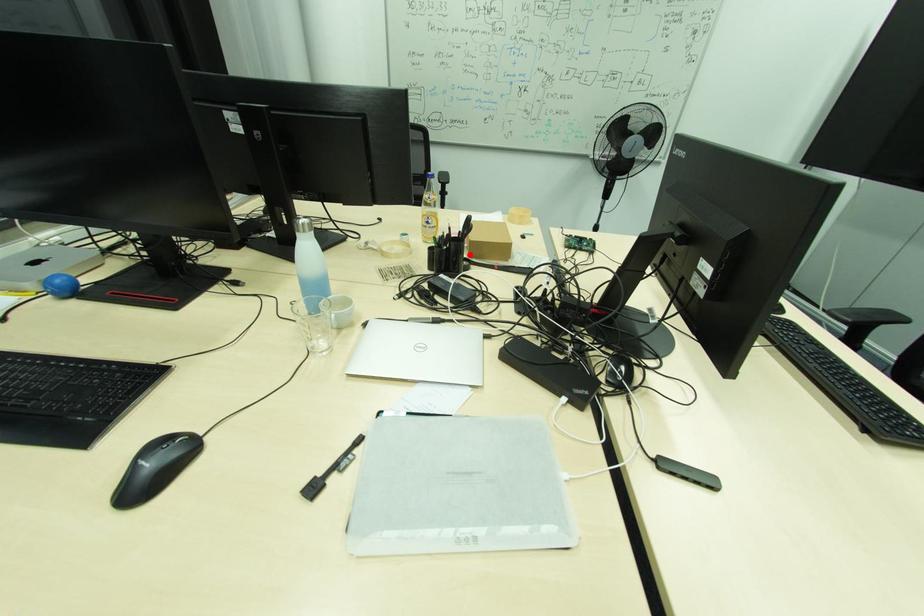
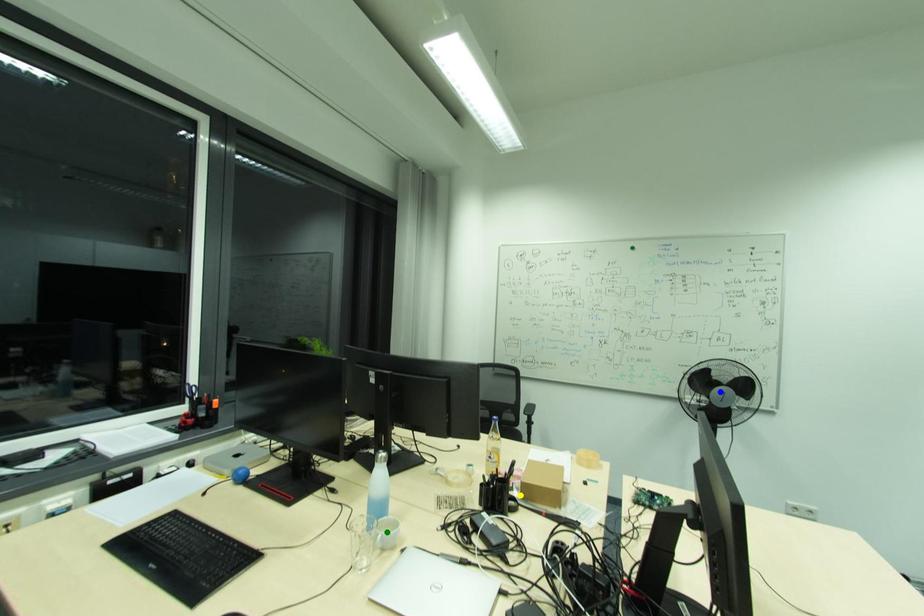
Question: I am providing you with two images of the same scene from different viewpoints. A red point is marked on the first image. You are given multiple points on the second image. Can you choose the point in image 2 that corresponds to the point in image 1?

Choices:
 (A) green point
 (B) yellow point
 (C) blue point

Answer: (B)